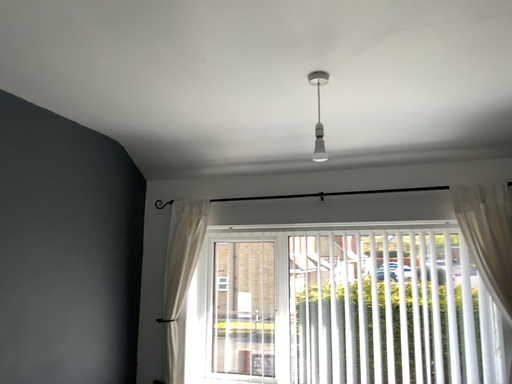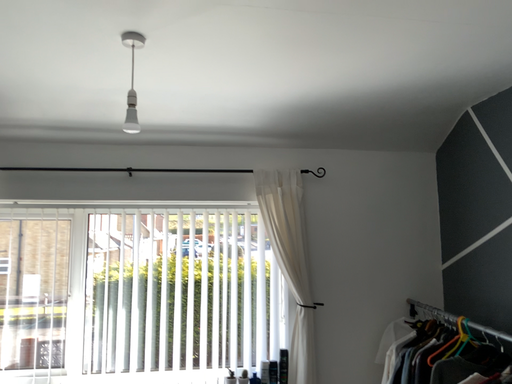
Question: How did the camera likely rotate when shooting the video?

Choices:
 (A) rotated left
 (B) rotated right

Answer: (B)